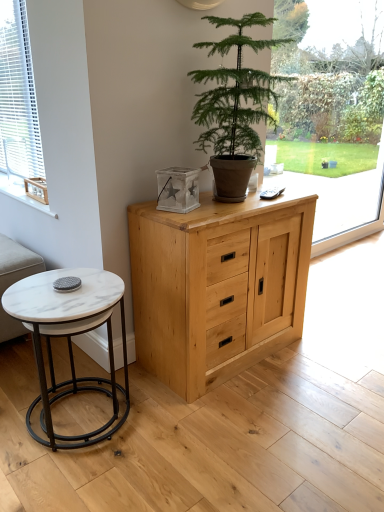
At what (x,y) coordinates should I click in order to perform the action: click on free space in front of white marble coffee table at lower left. Please return your answer as a coordinate pair (x, y). Image resolution: width=384 pixels, height=512 pixels. Looking at the image, I should click on (72, 481).